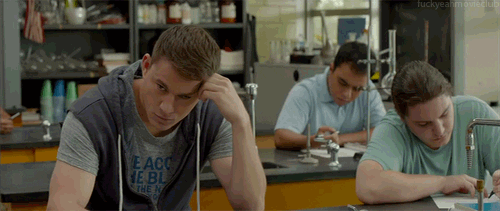
Locate an element on the screen. chemistry lab tables is located at coordinates (304, 170), (110, 185), (23, 179), (37, 133).